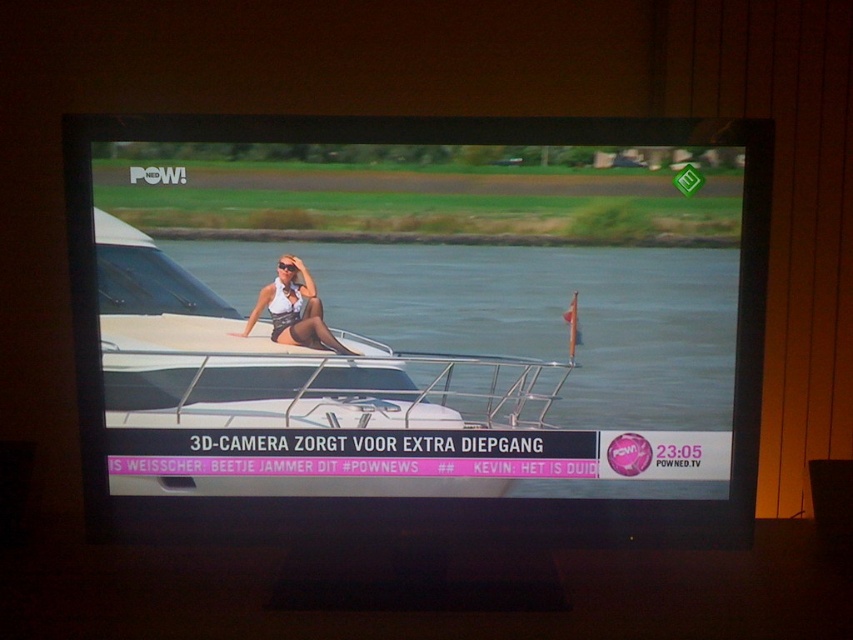
Based on the scene described, can you determine the position of the white glossy boat at center relative to the clear water at center?

The white glossy boat at center is positioned to the left of the clear water at center.

You are a photographer positioned at point 0.5, 0.5. You want to take a photo of the white glossy boat at center. Is the boat within your current field of view?

The white glossy boat at center is located at point (x=421, y=326), which is very close to your position at (x=426, y=320). Therefore, the boat is within your current field of view.

You are a photographer trying to capture the clear water at center and the matte white bikini at center in the same frame. Based on their positions, which object should you focus on first to ensure both are in the shot?

The clear water at center is positioned on the right side of matte white bikini at center, so you should focus on the matte white bikini at center first to ensure both are in the shot.